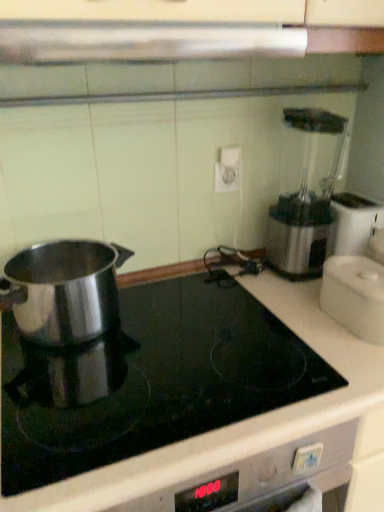
Question: From the image's perspective, is satin silver exhaust hood at upper center below polished stainless steel pot at left, arranged as the third kitchen appliance when viewed from the right?

Choices:
 (A) yes
 (B) no

Answer: (B)

Question: Is satin silver exhaust hood at upper center bigger than polished stainless steel pot at left, arranged as the 1th kitchen appliance when viewed from the left?

Choices:
 (A) no
 (B) yes

Answer: (A)

Question: Does satin silver exhaust hood at upper center touch polished stainless steel pot at left, arranged as the 1th kitchen appliance when viewed from the left?

Choices:
 (A) yes
 (B) no

Answer: (B)

Question: From the image's perspective, is satin silver exhaust hood at upper center on top of polished stainless steel pot at left, arranged as the third kitchen appliance when viewed from the right?

Choices:
 (A) yes
 (B) no

Answer: (A)

Question: Considering the relative positions of satin silver exhaust hood at upper center and polished stainless steel pot at left, arranged as the third kitchen appliance when viewed from the right, in the image provided, is satin silver exhaust hood at upper center to the right of polished stainless steel pot at left, arranged as the third kitchen appliance when viewed from the right, from the viewer's perspective?

Choices:
 (A) yes
 (B) no

Answer: (A)

Question: Considering their positions, is polished stainless steel pot at left, which appears as the 2th kitchen appliance when viewed from the left, located in front of or behind polished stainless steel pot at left, arranged as the third kitchen appliance when viewed from the right?

Choices:
 (A) front
 (B) behind

Answer: (A)

Question: Is polished stainless steel pot at left, arranged as the 2th kitchen appliance when viewed from the right, spatially inside polished stainless steel pot at left, arranged as the 1th kitchen appliance when viewed from the left, or outside of it?

Choices:
 (A) outside
 (B) inside

Answer: (A)

Question: Based on their sizes in the image, would you say polished stainless steel pot at left, which appears as the 2th kitchen appliance when viewed from the left, is bigger or smaller than polished stainless steel pot at left, arranged as the 1th kitchen appliance when viewed from the left?

Choices:
 (A) small
 (B) big

Answer: (B)

Question: From a real-world perspective, is polished stainless steel pot at left, which appears as the 2th kitchen appliance when viewed from the left, physically located above or below polished stainless steel pot at left, arranged as the 1th kitchen appliance when viewed from the left?

Choices:
 (A) above
 (B) below

Answer: (B)

Question: Is satin silver exhaust hood at upper center wider or thinner than polished stainless steel pot at left, arranged as the 2th kitchen appliance when viewed from the right?

Choices:
 (A) wide
 (B) thin

Answer: (B)

Question: From their relative heights in the image, would you say satin silver exhaust hood at upper center is taller or shorter than polished stainless steel pot at left, arranged as the 2th kitchen appliance when viewed from the right?

Choices:
 (A) tall
 (B) short

Answer: (B)

Question: Which is correct: satin silver exhaust hood at upper center is inside polished stainless steel pot at left, which appears as the 2th kitchen appliance when viewed from the left, or outside of it?

Choices:
 (A) inside
 (B) outside

Answer: (B)

Question: Based on their sizes in the image, would you say satin silver exhaust hood at upper center is bigger or smaller than polished stainless steel pot at left, arranged as the 2th kitchen appliance when viewed from the right?

Choices:
 (A) small
 (B) big

Answer: (A)

Question: Is point (294, 340) positioned closer to the camera than point (23, 36)?

Choices:
 (A) closer
 (B) farther

Answer: (B)

Question: Is polished stainless steel pot at left, arranged as the 2th kitchen appliance when viewed from the right, in front of or behind satin silver exhaust hood at upper center in the image?

Choices:
 (A) behind
 (B) front

Answer: (A)